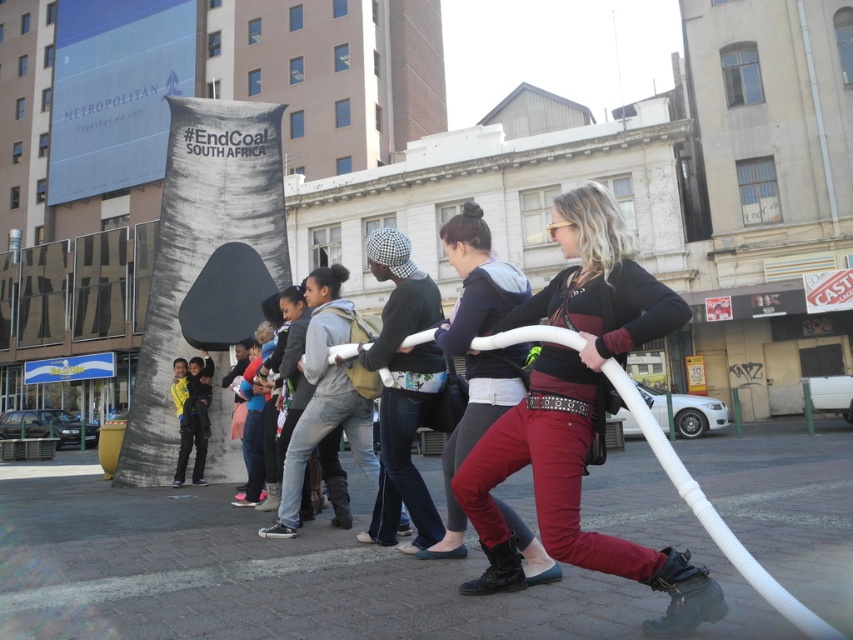
You are a photographer standing at the front of the demonstration. You want to capture a photo where the brick pavement at lower center and the matte black pants at center are both in focus. Which object should you focus on to ensure both are sharp?

To ensure both the brick pavement at lower center and the matte black pants at center are in focus, focus on the brick pavement at lower center since it is closer to the viewer, allowing the matte black pants at center to fall within the depth of field.

You are a photographer at the demonstration. You want to capture a photo where both the matte black jacket at center and the black cotton shirt at center are visible. Since you want to highlight the height difference between them, where should you position your camera?

Position the camera lower to emphasize the height difference between the matte black jacket at center and the black cotton shirt at center, as the matte black jacket at center is taller than the black cotton shirt at center.